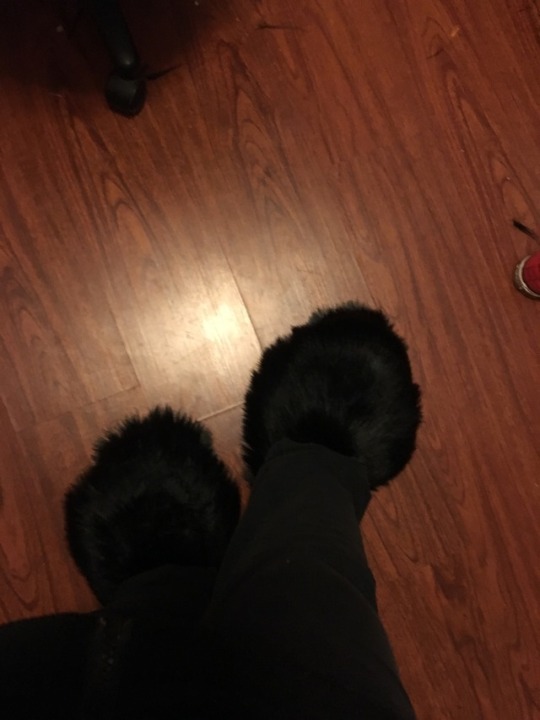
You are a GUI agent. You are given a task and a screenshot of the screen. Output one action in this format:
    pyautogui.click(x=<x>, y=<y>)
    Task: Click on the scrach on floor
    This screenshot has height=720, width=540.
    Given the screenshot: What is the action you would take?
    pyautogui.click(x=450, y=34)